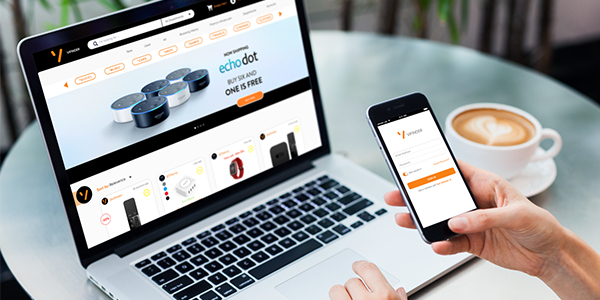
This screenshot has width=600, height=300. Identify the location of echo dot. (126, 101), (153, 90), (180, 75), (173, 95), (147, 111), (201, 80).